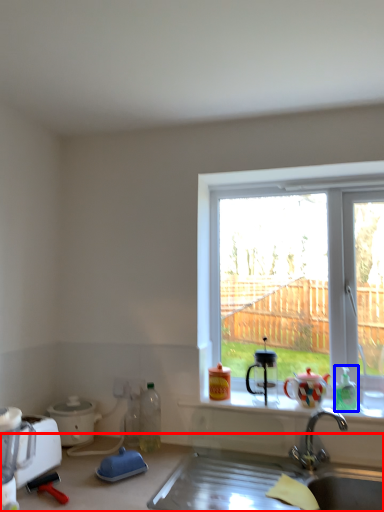
Question: Which of the following is the farthest to the observer, countertop (highlighted by a red box) or bottle (highlighted by a blue box)?

Choices:
 (A) countertop
 (B) bottle

Answer: (B)